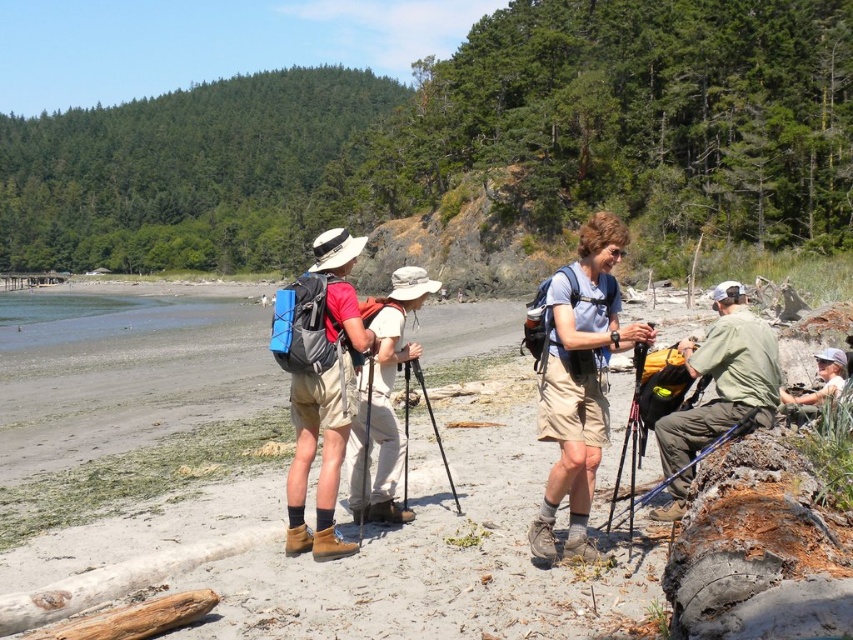
You are a GUI agent. You are given a task and a screenshot of the screen. Output one action in this format:
    pyautogui.click(x=<x>, y=<y>)
    Task: Click on the green fabric backpack at center
    This screenshot has height=640, width=853.
    Given the screenshot: What is the action you would take?
    pyautogui.click(x=718, y=388)

Does green fabric backpack at center appear on the right side of black metal tripod at center?

Correct, you'll find green fabric backpack at center to the right of black metal tripod at center.

Who is more distant from viewer, (x=730, y=355) or (x=405, y=400)?

Point (x=405, y=400)

I want to click on green fabric backpack at center, so click(718, 388).

Who is lower down, khaki cotton shorts at center or black metal tripod at center?

black metal tripod at center is below.

Looking at this image, can you confirm if khaki cotton shorts at center is positioned to the right of black metal tripod at center?

Indeed, khaki cotton shorts at center is positioned on the right side of black metal tripod at center.

Which is in front, point (410, 266) or point (425, 396)?

Point (425, 396) is in front.

Where is `khaki cotton shorts at center`? Image resolution: width=853 pixels, height=640 pixels. khaki cotton shorts at center is located at coordinates (383, 397).

Is the position of green fabric backpack at center more distant than that of khaki cotton shorts at center?

No, it is not.

Measure the distance between green fabric backpack at center and khaki cotton shorts at center.

The distance of green fabric backpack at center from khaki cotton shorts at center is 15.17 feet.

Describe the element at coordinates (718, 388) in the screenshot. Image resolution: width=853 pixels, height=640 pixels. I see `green fabric backpack at center` at that location.

Locate an element on the screen. This screenshot has height=640, width=853. green fabric backpack at center is located at coordinates click(x=718, y=388).